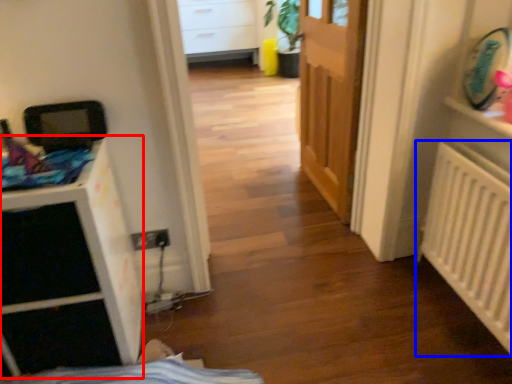
Question: Which of the following is the farthest to the observer, file cabinet (highlighted by a red box) or radiator (highlighted by a blue box)?

Choices:
 (A) file cabinet
 (B) radiator

Answer: (B)